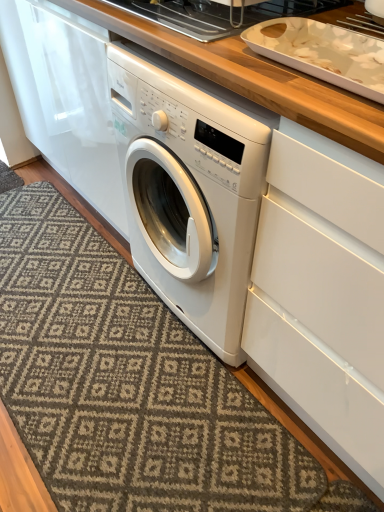
Where is `white glossy tray at upper center`? This screenshot has height=512, width=384. white glossy tray at upper center is located at coordinates (218, 14).

Considering the relative positions of white glossy tray at upper center and patterned carpet at lower left in the image provided, is white glossy tray at upper center behind patterned carpet at lower left?

Yes, it is behind patterned carpet at lower left.

Considering the relative sizes of white glossy tray at upper center and patterned carpet at lower left in the image provided, is white glossy tray at upper center taller than patterned carpet at lower left?

Yes.

From the image's perspective, which is below, white glossy tray at upper center or patterned carpet at lower left?

From the image's view, patterned carpet at lower left is below.

Is patterned carpet at lower left surrounded by white glossy tray at upper center?

No, patterned carpet at lower left is not inside white glossy tray at upper center.

Considering the sizes of objects white glossy tray at upper center and white glossy tray at upper right in the image provided, who is wider, white glossy tray at upper center or white glossy tray at upper right?

Wider between the two is white glossy tray at upper center.

Considering the relative positions of white glossy tray at upper center and white glossy tray at upper right in the image provided, is white glossy tray at upper center to the left of white glossy tray at upper right from the viewer's perspective?

Correct, you'll find white glossy tray at upper center to the left of white glossy tray at upper right.

Would you say white glossy tray at upper right is part of white glossy tray at upper center's contents?

No, white glossy tray at upper right is not inside white glossy tray at upper center.

From the image's perspective, between white glossy tray at upper center and white glossy tray at upper right, who is located below?

white glossy tray at upper right, from the image's perspective.

Which of these two, white glossy tray at upper right or white glossy tray at upper center, is thinner?

white glossy tray at upper right is thinner.

Does white glossy tray at upper right come behind white glossy tray at upper center?

That is False.

Considering the relative sizes of white glossy tray at upper right and white glossy tray at upper center in the image provided, is white glossy tray at upper right bigger than white glossy tray at upper center?

No.

From a real-world perspective, which is physically above, white glossy tray at upper right or white glossy tray at upper center?

white glossy tray at upper right, from a real-world perspective.

Which of these two, patterned carpet at lower left or white glossy tray at upper right, is smaller?

white glossy tray at upper right is smaller.

Does patterned carpet at lower left contain white glossy tray at upper right?

No, white glossy tray at upper right is not surrounded by patterned carpet at lower left.

Is patterned carpet at lower left positioned before white glossy tray at upper right?

No.

Is patterned carpet at lower left aimed at white glossy tray at upper right?

No, patterned carpet at lower left does not turn towards white glossy tray at upper right.

Considering the relative sizes of white glossy tray at upper right and patterned carpet at lower left in the image provided, is white glossy tray at upper right wider than patterned carpet at lower left?

In fact, white glossy tray at upper right might be narrower than patterned carpet at lower left.

Does point (261, 34) appear closer or farther from the camera than point (249, 422)?

Point (261, 34) is positioned closer to the camera compared to point (249, 422).

Could you tell me if white glossy tray at upper right is turned towards patterned carpet at lower left?

No, white glossy tray at upper right is not facing towards patterned carpet at lower left.

From their relative heights in the image, would you say patterned carpet at lower left is taller or shorter than white glossy tray at upper center?

Clearly, patterned carpet at lower left is shorter compared to white glossy tray at upper center.

Does patterned carpet at lower left turn towards white glossy tray at upper center?

No, patterned carpet at lower left is not oriented towards white glossy tray at upper center.

Which is in front, patterned carpet at lower left or white glossy tray at upper center?

patterned carpet at lower left is closer to the camera.

Is point (113, 509) closer to camera compared to point (276, 8)?

No, it is not.

Locate an element on the screen. The image size is (384, 512). appliance on the right of the patterned carpet at lower left is located at coordinates (218, 14).

Image resolution: width=384 pixels, height=512 pixels. In the image, there is a white glossy tray at upper center. In order to click on food below it (from the image's perspective) in this screenshot , I will do `click(325, 53)`.

Looking at this image, looking at the image, which one is located further to patterned carpet at lower left, white glossy tray at upper center or white glossy tray at upper right?

white glossy tray at upper center lies further to patterned carpet at lower left than the other object.

Estimate the real-world distances between objects in this image. Which object is closer to patterned carpet at lower left, white glossy tray at upper right or white glossy tray at upper center?

Among the two, white glossy tray at upper right is located nearer to patterned carpet at lower left.

Consider the image. Which object lies nearer to the anchor point white glossy tray at upper center, white glossy tray at upper right or patterned carpet at lower left?

white glossy tray at upper right.

Estimate the real-world distances between objects in this image. Which object is further from white glossy tray at upper right, white glossy tray at upper center or patterned carpet at lower left?

Based on the image, patterned carpet at lower left appears to be further to white glossy tray at upper right.

When comparing their distances from white glossy tray at upper right, does patterned carpet at lower left or white glossy tray at upper center seem further?

patterned carpet at lower left.

Which object lies nearer to the anchor point white glossy tray at upper center, patterned carpet at lower left or white glossy tray at upper right?

The object closer to white glossy tray at upper center is white glossy tray at upper right.

Identify the location of food between white glossy tray at upper center and patterned carpet at lower left in the up-down direction. The height and width of the screenshot is (512, 384). (325, 53).